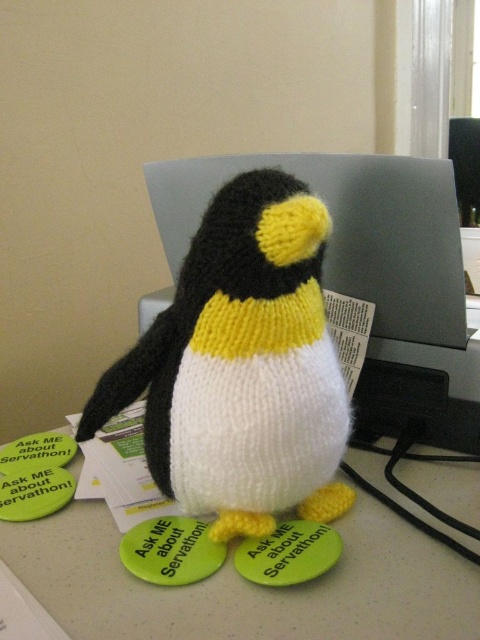
Question: Which point is farther from the camera taking this photo?

Choices:
 (A) (252, 394)
 (B) (337, 180)

Answer: (B)

Question: Where is white knitted fabric penguin at center located in relation to matte gray computer at center in the image?

Choices:
 (A) left
 (B) right

Answer: (A)

Question: Which point is closer to the camera taking this photo?

Choices:
 (A) (410, 483)
 (B) (391, 289)

Answer: (A)

Question: Is knitted black and white penguin at center to the right of white knitted fabric penguin at center from the viewer's perspective?

Choices:
 (A) no
 (B) yes

Answer: (A)

Question: Which object is farther from the camera taking this photo?

Choices:
 (A) white knitted fabric penguin at center
 (B) matte gray computer at center

Answer: (B)

Question: Does white knitted fabric penguin at center appear over matte gray computer at center?

Choices:
 (A) no
 (B) yes

Answer: (A)